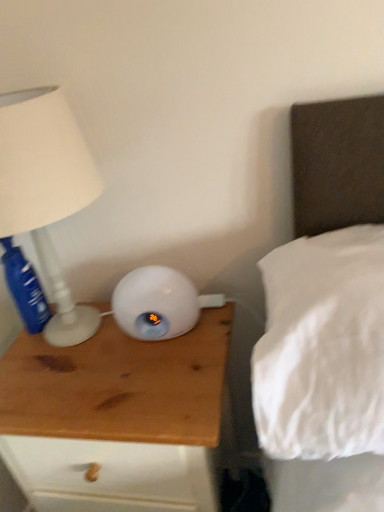
Where is `vacant region under white matte lamp at left (from a real-world perspective)`? The height and width of the screenshot is (512, 384). vacant region under white matte lamp at left (from a real-world perspective) is located at coordinates (67, 341).